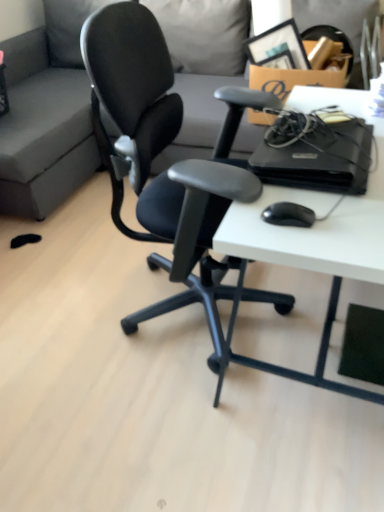
What are the coordinates of `black plastic computer at right` in the screenshot? It's located at (315, 152).

In order to face cardboard box at upper right, should I rotate leftwards or rightwards?

To face it directly, rotate right by 13.956 degrees.

The width and height of the screenshot is (384, 512). What do you see at coordinates (43, 129) in the screenshot?
I see `gray fabric couch at upper center` at bounding box center [43, 129].

Where is `black plastic computer at right`? The image size is (384, 512). black plastic computer at right is located at coordinates (315, 152).

Which point is more forward, (327,167) or (259,86)?

The point (327,167) is more forward.

Considering the positions of objects black plastic computer at right and cardboard box at upper right in the image provided, who is more to the right, black plastic computer at right or cardboard box at upper right?

From the viewer's perspective, cardboard box at upper right appears more on the right side.

Is black plastic computer at right far away from cardboard box at upper right?

No, black plastic computer at right is not far from cardboard box at upper right.

From the image's perspective, which object appears higher, black plastic computer at right or cardboard box at upper right?

cardboard box at upper right appears higher in the image.

Is white matte desk at center taller or shorter than gray fabric couch at upper center?

Clearly, white matte desk at center is shorter compared to gray fabric couch at upper center.

Considering their positions, is white matte desk at center located in front of or behind gray fabric couch at upper center?

Visually, white matte desk at center is located in front of gray fabric couch at upper center.

Identify the location of studio couch above the white matte desk at center (from the image's perspective). (43, 129).

Can white matte desk at center be found inside black plastic computer at right?

No, white matte desk at center is not a part of black plastic computer at right.

From a real-world perspective, who is located lower, black plastic computer at right or white matte desk at center?

white matte desk at center is physically lower.

Is black plastic computer at right oriented towards white matte desk at center?

No, black plastic computer at right is not aimed at white matte desk at center.

Can you confirm if gray fabric couch at upper center is smaller than black plastic computer at right?

No.

Consider the image. Which object is further away from the camera, gray fabric couch at upper center or black plastic computer at right?

gray fabric couch at upper center is more distant.

The height and width of the screenshot is (512, 384). Identify the location of studio couch above the black plastic computer at right (from the image's perspective). (43, 129).

Can you confirm if gray fabric couch at upper center is wider than black plastic computer at right?

Yes.

Considering the sizes of objects black matte mouse at lower right and white matte desk at center in the image provided, who is shorter, black matte mouse at lower right or white matte desk at center?

Standing shorter between the two is black matte mouse at lower right.

From a real-world perspective, is black matte mouse at lower right physically located above or below white matte desk at center?

black matte mouse at lower right is situated higher than white matte desk at center in the real world.

Is black matte mouse at lower right not near white matte desk at center?

No, black matte mouse at lower right is not far away from white matte desk at center.

Does gray fabric couch at upper center have a lesser height compared to black matte mouse at lower right?

No.

From a real-world perspective, between gray fabric couch at upper center and black matte mouse at lower right, who is vertically lower?

gray fabric couch at upper center, from a real-world perspective.

Could black matte mouse at lower right be considered to be inside gray fabric couch at upper center?

No, black matte mouse at lower right is located outside of gray fabric couch at upper center.

From the image's perspective, between gray fabric couch at upper center and black matte mouse at lower right, who is located below?

black matte mouse at lower right is shown below in the image.

From a real-world perspective, is white matte desk at center on cardboard box at upper right?

No, from a real-world perspective, white matte desk at center is not over cardboard box at upper right

Choose the correct answer: Is white matte desk at center inside cardboard box at upper right or outside it?

white matte desk at center lies outside cardboard box at upper right.

Is point (336, 390) behind point (335, 55)?

No, (336, 390) is closer to viewer.

The image size is (384, 512). Find the location of `computer that is on the left side of cardboard box at upper right`. computer that is on the left side of cardboard box at upper right is located at coordinates tap(315, 152).

Identify the location of desk lying in front of the gray fabric couch at upper center. The width and height of the screenshot is (384, 512). (319, 227).

From the image, which object appears to be nearer to cardboard box at upper right, black matte mouse at lower right or black plastic computer at right?

black plastic computer at right is closer to cardboard box at upper right.

Estimate the real-world distances between objects in this image. Which object is further from white matte desk at center, black matte mouse at lower right or cardboard box at upper right?

cardboard box at upper right.

From the image, which object appears to be nearer to gray fabric couch at upper center, white matte desk at center or black matte mouse at lower right?

Among the two, white matte desk at center is located nearer to gray fabric couch at upper center.

Considering their positions, is white matte desk at center positioned further to cardboard box at upper right than black matte mouse at lower right?

black matte mouse at lower right.

In the scene shown: Looking at the image, which one is located further to gray fabric couch at upper center, black matte mouse at lower right or white matte desk at center?

Based on the image, black matte mouse at lower right appears to be further to gray fabric couch at upper center.

From the image, which object appears to be farther from cardboard box at upper right, gray fabric couch at upper center or white matte desk at center?

gray fabric couch at upper center is further to cardboard box at upper right.

When comparing their distances from cardboard box at upper right, does black plastic computer at right or black matte mouse at lower right seem closer?

black plastic computer at right.

Considering their positions, is black plastic computer at right positioned closer to black matte mouse at lower right than gray fabric couch at upper center?

The object closer to black matte mouse at lower right is black plastic computer at right.

Image resolution: width=384 pixels, height=512 pixels. I want to click on studio couch between white matte desk at center and cardboard box at upper right from front to back, so click(x=43, y=129).

Where is `mouse between white matte desk at center and cardboard box at upper right along the z-axis`? The image size is (384, 512). mouse between white matte desk at center and cardboard box at upper right along the z-axis is located at coordinates (288, 215).

This screenshot has width=384, height=512. What are the coordinates of `mouse between black plastic computer at right and white matte desk at center in the vertical direction` in the screenshot? It's located at (288, 215).

Where is `studio couch between black plastic computer at right and cardboard box at upper right in the front-back direction`? The width and height of the screenshot is (384, 512). studio couch between black plastic computer at right and cardboard box at upper right in the front-back direction is located at coordinates (43, 129).